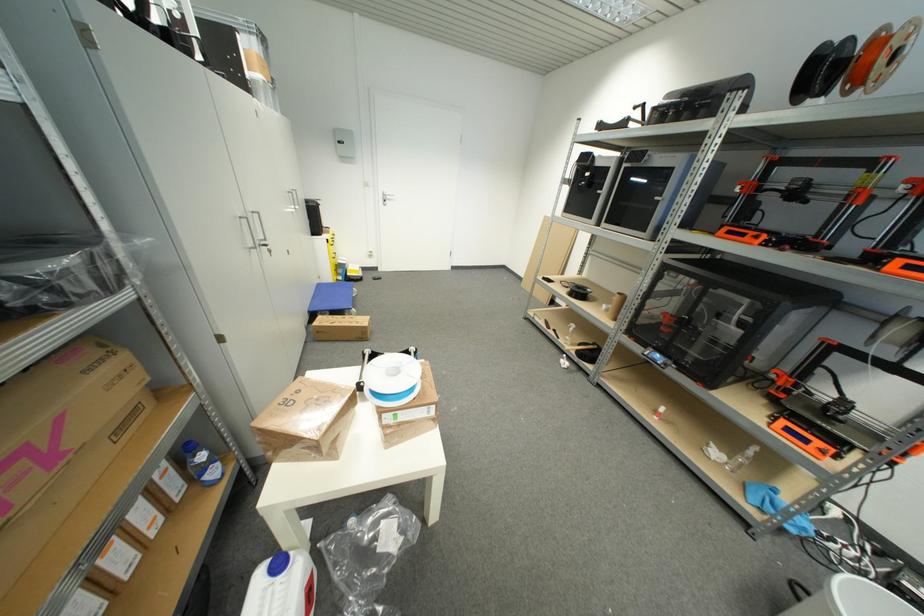
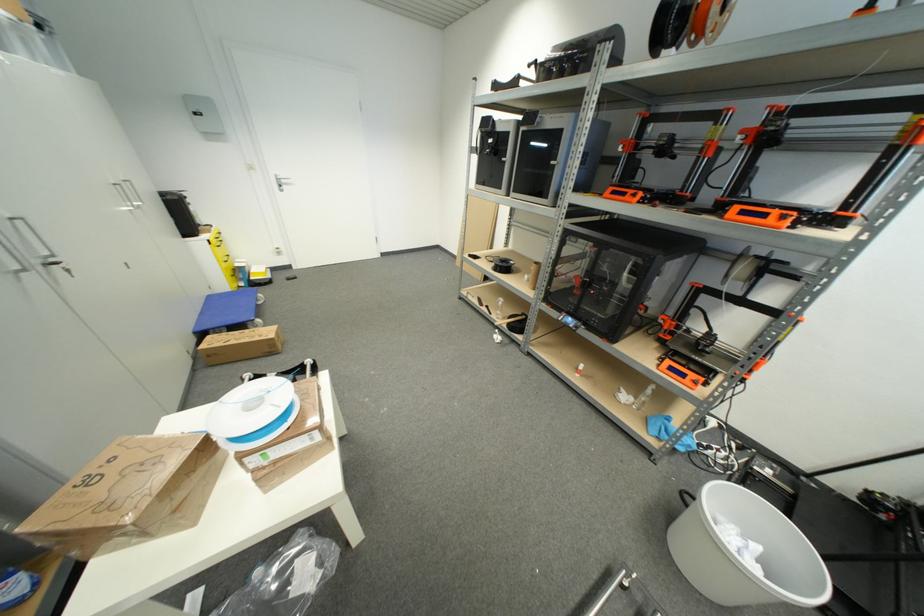
Locate, in the second image, the point that corresponds to point (794, 432) in the first image.

(675, 371)